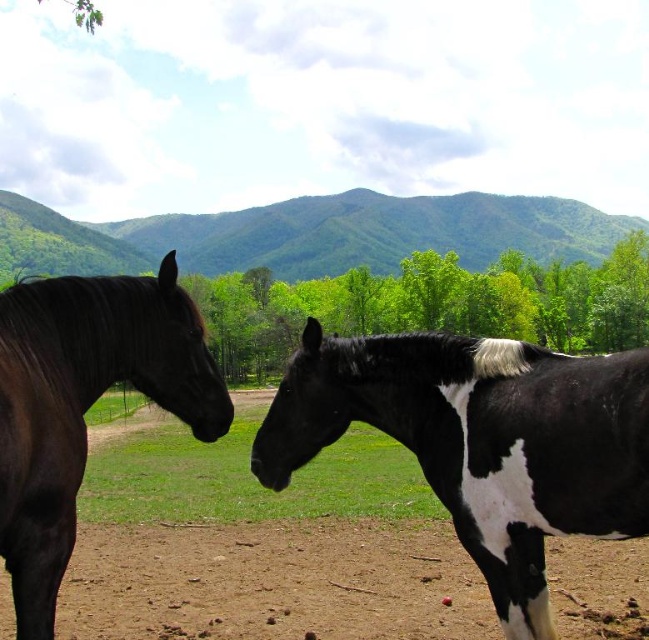
Question: Can you confirm if black and white speckled horse at center is thinner than shiny dark brown horse at left?

Choices:
 (A) yes
 (B) no

Answer: (B)

Question: Which object is closer to the camera taking this photo?

Choices:
 (A) black and white speckled horse at center
 (B) shiny dark brown horse at left

Answer: (B)

Question: Can you confirm if black and white speckled horse at center is smaller than shiny dark brown horse at left?

Choices:
 (A) yes
 (B) no

Answer: (B)

Question: Which object appears farthest from the camera in this image?

Choices:
 (A) shiny dark brown horse at left
 (B) black and white speckled horse at center

Answer: (B)

Question: Does black and white speckled horse at center come in front of shiny dark brown horse at left?

Choices:
 (A) yes
 (B) no

Answer: (B)

Question: Among these objects, which one is farthest from the camera?

Choices:
 (A) black and white speckled horse at center
 (B) shiny dark brown horse at left

Answer: (A)